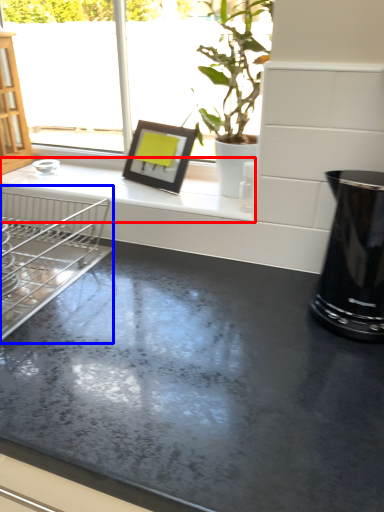
Question: Which point is further to the camera, counter top (highlighted by a red box) or dish washer (highlighted by a blue box)?

Choices:
 (A) counter top
 (B) dish washer

Answer: (A)